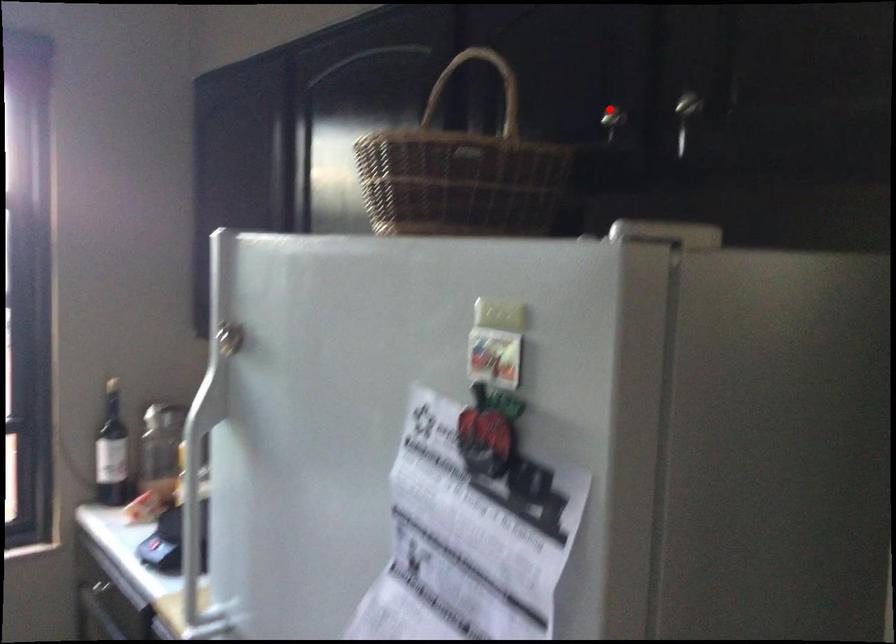
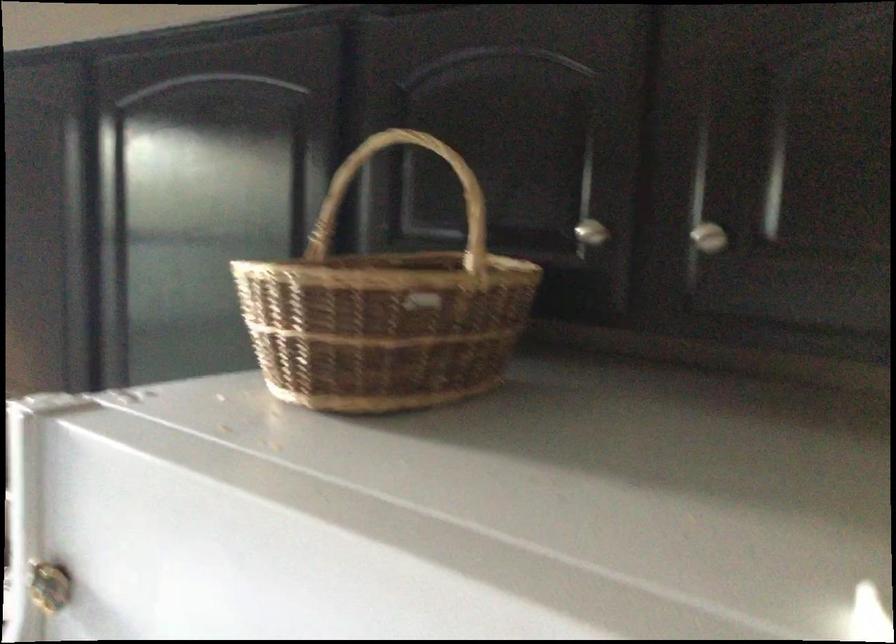
Where in the second image is the point corresponding to the highlighted location from the first image?

(590, 232)